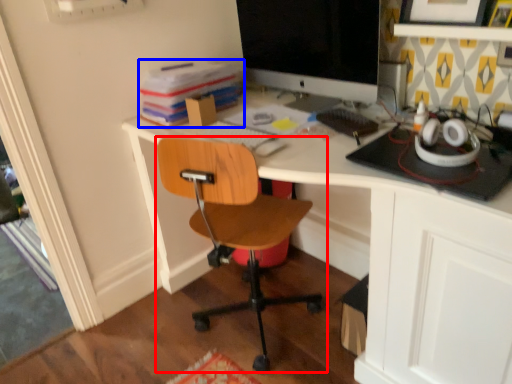
Question: Which of the following is the closest to the observer, chair (highlighted by a red box) or book (highlighted by a blue box)?

Choices:
 (A) chair
 (B) book

Answer: (A)